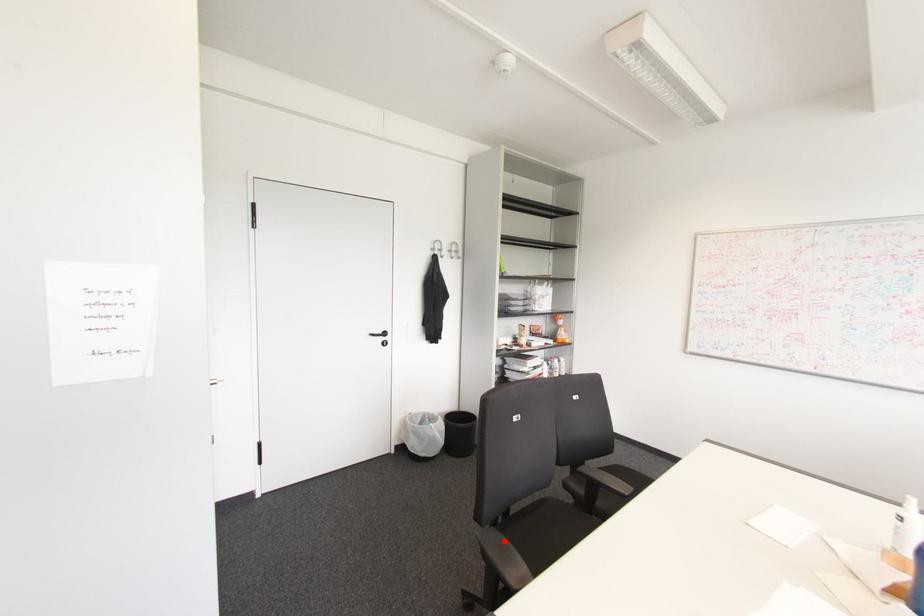
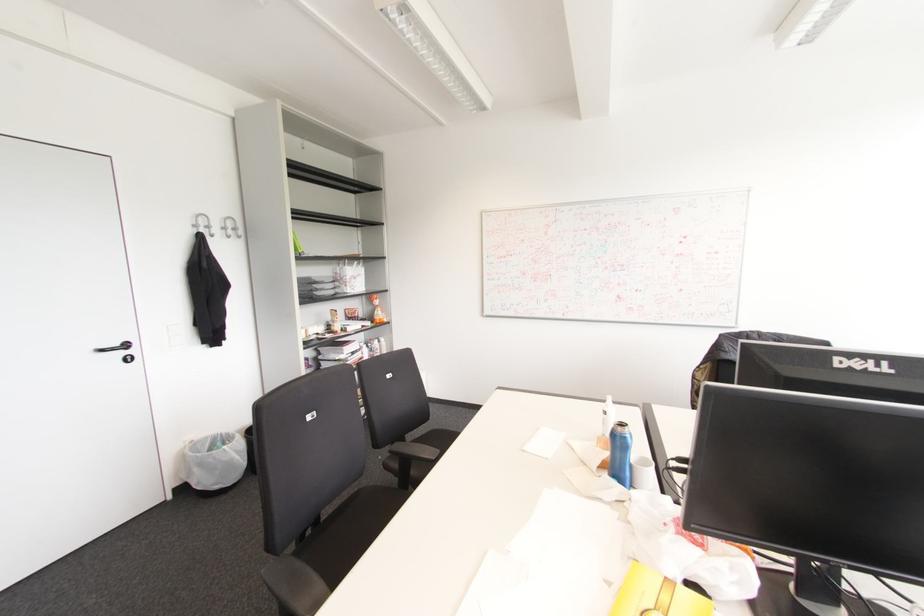
Find the pixel in the second image that matches the highlighted location in the first image.

(298, 564)